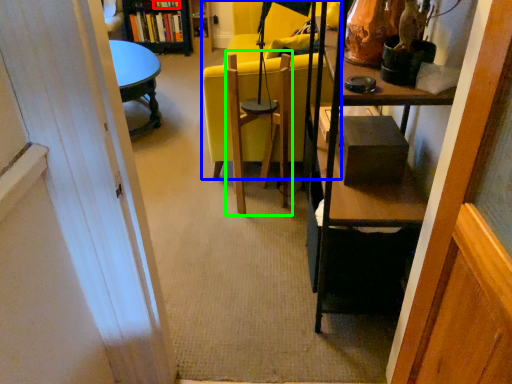
Question: Considering the real-world distances, which object is closest to book (highlighted by a red box)? chair (highlighted by a blue box) or swivel chair (highlighted by a green box).

Choices:
 (A) chair
 (B) swivel chair

Answer: (A)